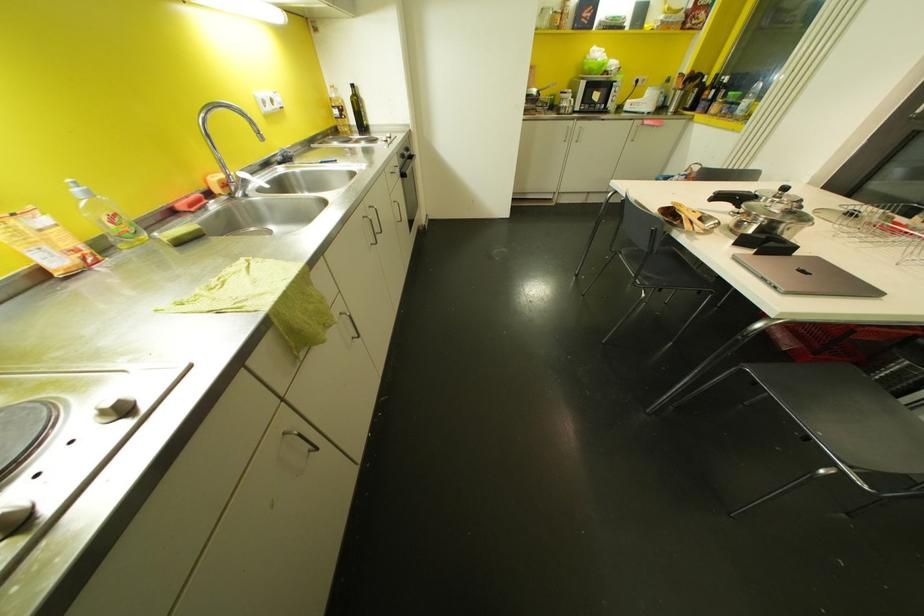
Find the location of `black pot handle`. black pot handle is located at coordinates (725, 197).